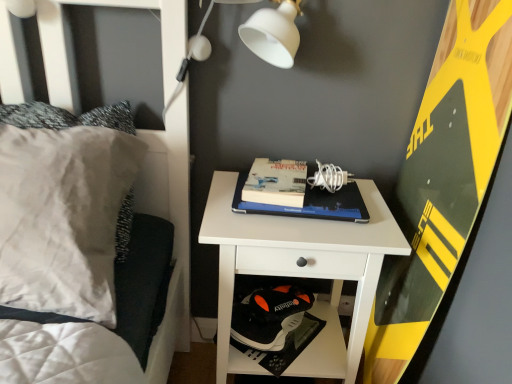
The height and width of the screenshot is (384, 512). Describe the element at coordinates (301, 272) in the screenshot. I see `white matte nightstand at center` at that location.

The image size is (512, 384). I want to click on hardcover book at center, which is the 1th paperback book from left to right, so click(276, 182).

The height and width of the screenshot is (384, 512). I want to click on yellow-green textured board at right, so click(x=442, y=180).

Which is in front, point (294, 51) or point (302, 295)?

The point (294, 51) is more forward.

Is white matte lampshade at upper center positioned far away from black matte shoe at lower center?

No, white matte lampshade at upper center is in close proximity to black matte shoe at lower center.

How different are the orientations of white matte lampshade at upper center and black matte shoe at lower center in degrees?

white matte lampshade at upper center and black matte shoe at lower center are facing 37 degrees away from each other.

From the image's perspective, which one is positioned lower, white matte lampshade at upper center or black matte shoe at lower center?

black matte shoe at lower center, from the image's perspective.

How many degrees apart are the facing directions of white matte nightstand at center and hardcover book at center, the second paperback book when ordered from right to left?

8.2 degrees.

Can you confirm if white matte nightstand at center is positioned to the left of hardcover book at center, which is the 1th paperback book from left to right?

In fact, white matte nightstand at center is to the right of hardcover book at center, which is the 1th paperback book from left to right.

In terms of size, does white matte nightstand at center appear bigger or smaller than hardcover book at center, which is the 1th paperback book from left to right?

In the image, white matte nightstand at center appears to be larger than hardcover book at center, which is the 1th paperback book from left to right.

Is white matte nightstand at center in front of or behind hardcover book at center, which is the 1th paperback book from left to right, in the image?

In the image, white matte nightstand at center appears in front of hardcover book at center, which is the 1th paperback book from left to right.

Considering the points (270, 348) and (291, 251), which point is in front, point (270, 348) or point (291, 251)?

Positioned in front is point (291, 251).

How many degrees apart are the facing directions of black matte shoe at lower center and white matte nightstand at center?

The angle between the facing direction of black matte shoe at lower center and the facing direction of white matte nightstand at center is 37.9 degrees.

Would you consider black matte shoe at lower center to be distant from white matte nightstand at center?

No, black matte shoe at lower center is in close proximity to white matte nightstand at center.

Are white matte lampshade at upper center and yellow-green textured board at right located far from each other?

No, white matte lampshade at upper center is not far from yellow-green textured board at right.

Looking at this image, considering the positions of objects white matte lampshade at upper center and yellow-green textured board at right in the image provided, who is more to the right, white matte lampshade at upper center or yellow-green textured board at right?

yellow-green textured board at right.

Is white matte lampshade at upper center completely or partially outside of yellow-green textured board at right?

Absolutely, white matte lampshade at upper center is external to yellow-green textured board at right.

Considering the relative sizes of white matte lampshade at upper center and yellow-green textured board at right in the image provided, is white matte lampshade at upper center bigger than yellow-green textured board at right?

Actually, white matte lampshade at upper center might be smaller than yellow-green textured board at right.

Can you tell me how much hardcover book at center, which is counted as the 2th paperback book, starting from the left, and white matte lampshade at upper center differ in facing direction?

The angular difference between hardcover book at center, which is counted as the 2th paperback book, starting from the left, and white matte lampshade at upper center is 1.68 degrees.

From the image's perspective, does hardcover book at center, which ranks as the 1th paperback book in right-to-left order, appear lower than white matte lampshade at upper center?

Yes.

Which is in front, hardcover book at center, which ranks as the 1th paperback book in right-to-left order, or white matte lampshade at upper center?

Positioned in front is white matte lampshade at upper center.

In the scene shown: Considering the sizes of objects hardcover book at center, which is counted as the 2th paperback book, starting from the left, and white matte lampshade at upper center in the image provided, who is taller, hardcover book at center, which is counted as the 2th paperback book, starting from the left, or white matte lampshade at upper center?

white matte lampshade at upper center is taller.

Between yellow-green textured board at right and hardcover book at center, which is counted as the 2th paperback book, starting from the left, which one has more height?

yellow-green textured board at right.

From a real-world perspective, is yellow-green textured board at right on top of hardcover book at center, which is counted as the 2th paperback book, starting from the left?

No.

Is yellow-green textured board at right at the right side of hardcover book at center, which ranks as the 1th paperback book in right-to-left order?

Yes, yellow-green textured board at right is to the right of hardcover book at center, which ranks as the 1th paperback book in right-to-left order.

Is yellow-green textured board at right oriented towards hardcover book at center, which is counted as the 2th paperback book, starting from the left?

Yes, yellow-green textured board at right is facing hardcover book at center, which is counted as the 2th paperback book, starting from the left.

Can you confirm if hardcover book at center, the second paperback book when ordered from right to left, is taller than white matte lampshade at upper center?

In fact, hardcover book at center, the second paperback book when ordered from right to left, may be shorter than white matte lampshade at upper center.

Is hardcover book at center, which is the 1th paperback book from left to right, wider than white matte lampshade at upper center?

Yes.

Does point (244, 190) lie in front of point (208, 45)?

Yes.

How different are the orientations of hardcover book at center, which is the 1th paperback book from left to right, and white matte lampshade at upper center in degrees?

7.3 degrees.

This screenshot has width=512, height=384. I want to click on light fixture above the black matte shoe at lower center (from the image's perspective), so click(x=273, y=33).

This screenshot has width=512, height=384. Find the location of `nightstand that is in front of the hardcover book at center, the second paperback book when ordered from right to left`. nightstand that is in front of the hardcover book at center, the second paperback book when ordered from right to left is located at coordinates 301,272.

Based on the photo, based on their spatial positions, is yellow-green textured board at right or hardcover book at center, which ranks as the 1th paperback book in right-to-left order, closer to hardcover book at center, the second paperback book when ordered from right to left?

hardcover book at center, which ranks as the 1th paperback book in right-to-left order, lies closer to hardcover book at center, the second paperback book when ordered from right to left, than the other object.

From the image, which object appears to be nearer to white soft pillow at left, hardcover book at center, the second paperback book when ordered from right to left, or yellow-green textured board at right?

The object closer to white soft pillow at left is hardcover book at center, the second paperback book when ordered from right to left.

When comparing their distances from hardcover book at center, which ranks as the 1th paperback book in right-to-left order, does white matte lampshade at upper center or white matte nightstand at center seem further?

The object further to hardcover book at center, which ranks as the 1th paperback book in right-to-left order, is white matte lampshade at upper center.

Considering their positions, is black matte shoe at lower center positioned further to hardcover book at center, which ranks as the 1th paperback book in right-to-left order, than hardcover book at center, which is the 1th paperback book from left to right?

black matte shoe at lower center is further to hardcover book at center, which ranks as the 1th paperback book in right-to-left order.

Which object lies further to the anchor point white matte lampshade at upper center, hardcover book at center, the second paperback book when ordered from right to left, or black matte shoe at lower center?

The object further to white matte lampshade at upper center is black matte shoe at lower center.

Which object lies nearer to the anchor point white matte lampshade at upper center, hardcover book at center, which ranks as the 1th paperback book in right-to-left order, or white matte nightstand at center?

hardcover book at center, which ranks as the 1th paperback book in right-to-left order.

Based on their spatial positions, is hardcover book at center, which ranks as the 1th paperback book in right-to-left order, or black matte shoe at lower center closer to white matte lampshade at upper center?

Based on the image, hardcover book at center, which ranks as the 1th paperback book in right-to-left order, appears to be nearer to white matte lampshade at upper center.

Estimate the real-world distances between objects in this image. Which object is further from white matte nightstand at center, black matte shoe at lower center or yellow-green textured board at right?

Based on the image, yellow-green textured board at right appears to be further to white matte nightstand at center.

You are a GUI agent. You are given a task and a screenshot of the screen. Output one action in this format:
    pyautogui.click(x=<x>, y=<y>)
    Task: Click on the paperback book positioned between yellow-green textured board at right and hardcover book at center, the second paperback book when ordered from right to left, from near to far
    The height and width of the screenshot is (384, 512).
    Given the screenshot: What is the action you would take?
    pyautogui.click(x=302, y=207)

Identify the location of nightstand between white soft pillow at left and hardcover book at center, which is counted as the 2th paperback book, starting from the left, from left to right. (301, 272).

At what (x,y) coordinates should I click in order to perform the action: click on nightstand between yellow-green textured board at right and hardcover book at center, which is counted as the 2th paperback book, starting from the left, along the z-axis. Please return your answer as a coordinate pair (x, y). The image size is (512, 384). Looking at the image, I should click on (301, 272).

Where is `pillow between white matte lampshade at upper center and white matte nightstand at center in the up-down direction`? pillow between white matte lampshade at upper center and white matte nightstand at center in the up-down direction is located at coordinates (63, 217).